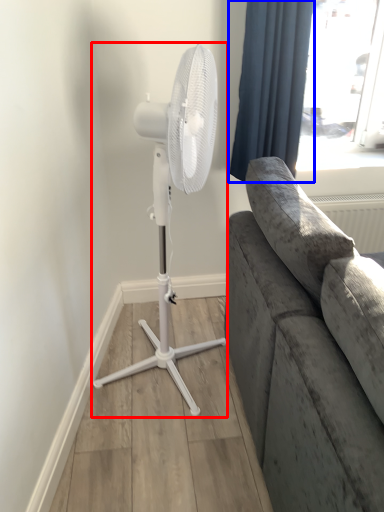
Question: Which object appears closest to the camera in this image, mechanical fan (highlighted by a red box) or curtain (highlighted by a blue box)?

Choices:
 (A) mechanical fan
 (B) curtain

Answer: (A)